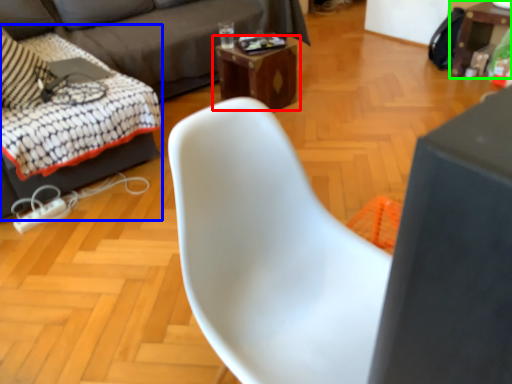
Question: Based on their relative distances, which object is nearer to table (highlighted by a red box)? Choose from swivel chair (highlighted by a blue box) and table (highlighted by a green box).

Choices:
 (A) swivel chair
 (B) table

Answer: (A)